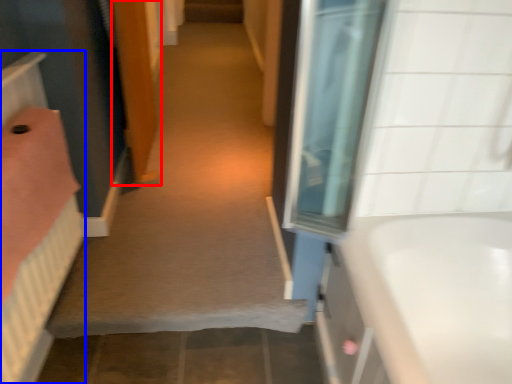
Question: Which object appears farthest to the camera in this image, door (highlighted by a red box) or bed (highlighted by a blue box)?

Choices:
 (A) door
 (B) bed

Answer: (A)